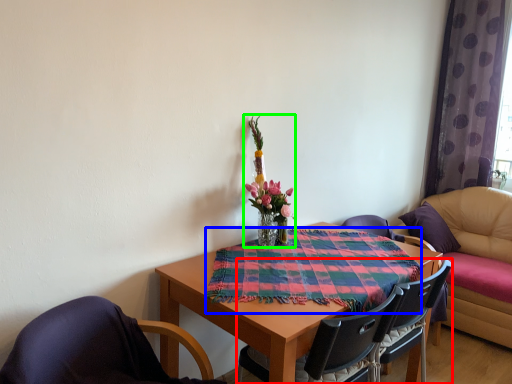
Question: Which is farther away from chair (highlighted by a red box)? cloth (highlighted by a blue box) or floral arrangement (highlighted by a green box)?

Choices:
 (A) cloth
 (B) floral arrangement

Answer: (B)